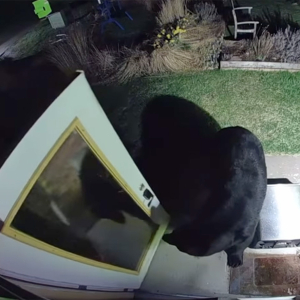
The width and height of the screenshot is (300, 300). Find the location of `area below small seat`. area below small seat is located at coordinates (243, 34).